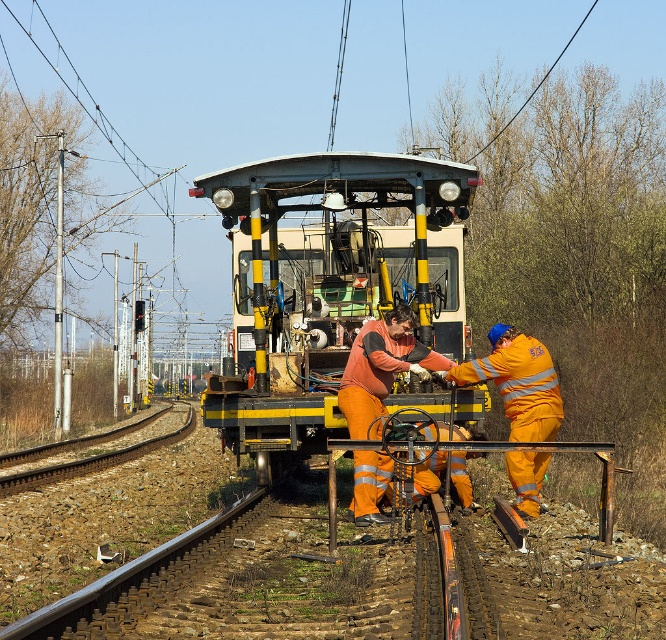
You are a railway worker standing at point A located at coordinates point A at (380,305). You need to walk to point B, which is 14.05 meters away. If your walking speed is 1.5 meters per second, how many seconds will it take you to reach point B?

The distance between point A at 0.472 and point B is 14.05 meters. At a walking speed of 1.5 meters per second, it will take approximately 9.37 seconds to reach point B.

Based on the scene description, where is the metallic yellow train at center located in terms of coordinates?

The metallic yellow train at center is located at coordinates point (324,284).

Based on the photo, you are a railway inspector checking the alignment of the metallic yellow train at center and the orange reflective rail at center. Based on the scene, is the train properly aligned with the rail?

The metallic yellow train at center is positioned over orange reflective rail at center, indicating proper alignment between the two.